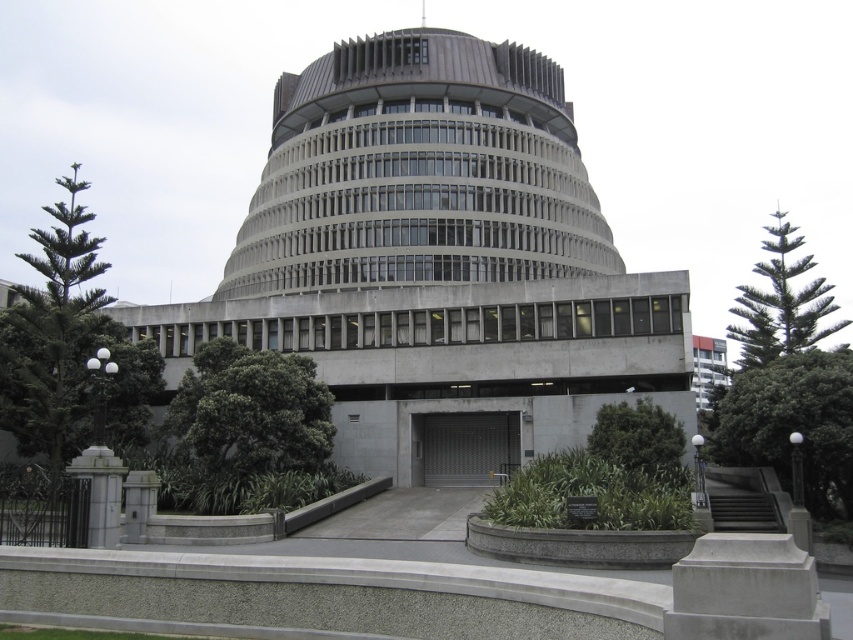
Question: Which of these objects is positioned closest to the green textured pine tree at upper right?

Choices:
 (A) green leafy tree at right
 (B) green leafy bush at center
 (C) green leafy tree at center

Answer: (A)

Question: Which object is farther from the camera taking this photo?

Choices:
 (A) green textured pine tree at upper right
 (B) green leafy bush at center
 (C) green leafy tree at right

Answer: (A)

Question: Is green leafy tree at right to the right of green leafy tree at center from the viewer's perspective?

Choices:
 (A) yes
 (B) no

Answer: (A)

Question: Which point appears farthest from the camera in this image?

Choices:
 (A) click(x=740, y=436)
 (B) click(x=631, y=438)

Answer: (B)

Question: Does green leafy tree at left have a greater width compared to green textured pine tree at upper right?

Choices:
 (A) no
 (B) yes

Answer: (B)

Question: Can you confirm if green leafy tree at left is positioned to the right of green leafy tree at center?

Choices:
 (A) no
 (B) yes

Answer: (A)